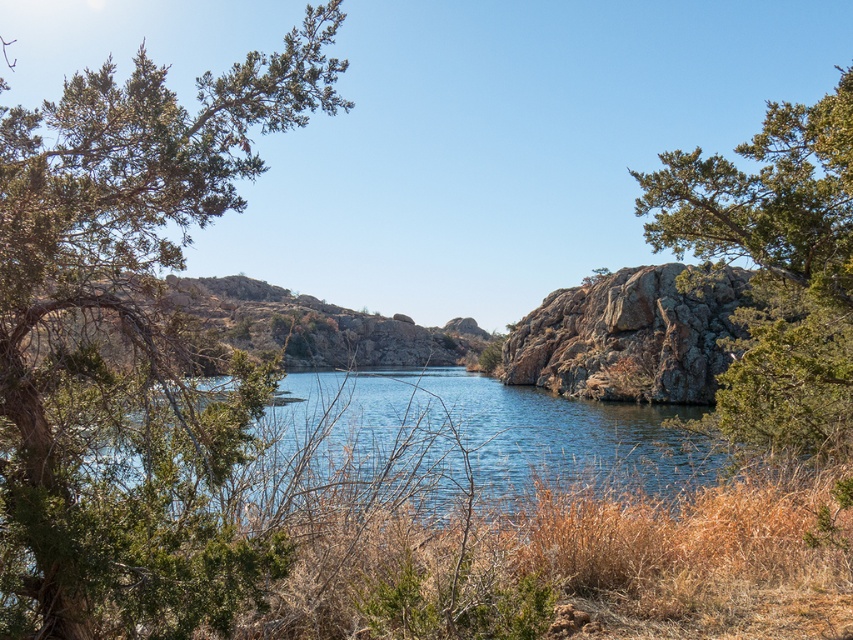
Question: Which object appears farthest from the camera in this image?

Choices:
 (A) rusty rock at center
 (B) green textured rock at right

Answer: (A)

Question: Is green textured rock at right thinner than rusty rock at center?

Choices:
 (A) no
 (B) yes

Answer: (B)

Question: Can you confirm if green leafy tree at left is positioned above rusty rock at center?

Choices:
 (A) no
 (B) yes

Answer: (B)

Question: Is green textured rock at right behind rusty rock at center?

Choices:
 (A) yes
 (B) no

Answer: (B)

Question: Which object is farther from the camera taking this photo?

Choices:
 (A) green textured rock at right
 (B) green leafy tree at left
 (C) rusty rock at center

Answer: (C)

Question: Which of the following is the closest to the observer?

Choices:
 (A) green leafy tree at left
 (B) green textured rock at right

Answer: (A)